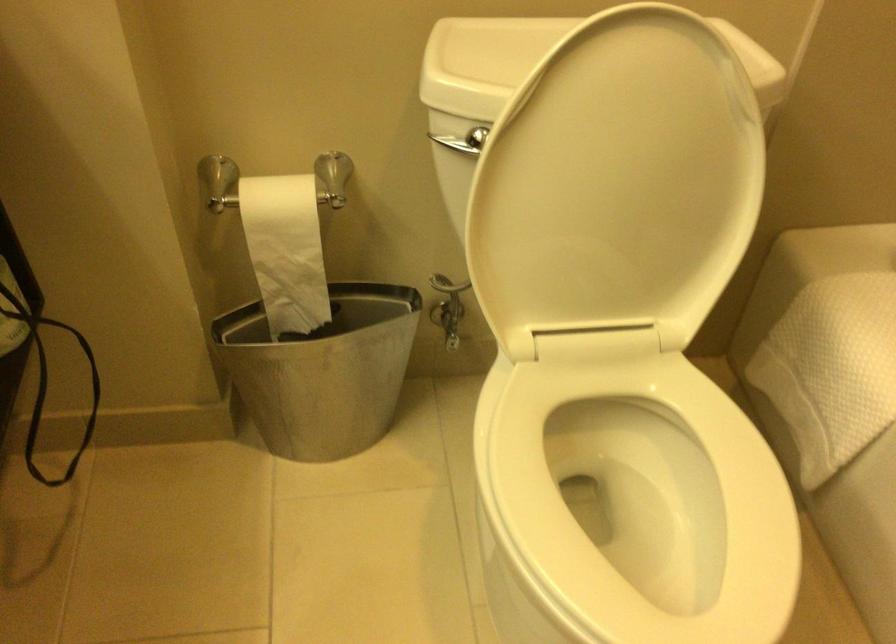
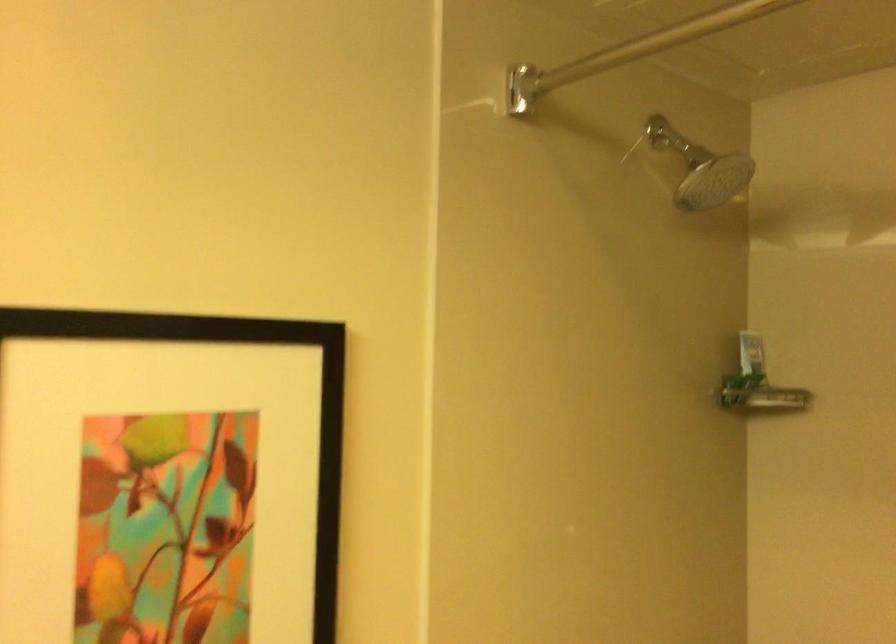
Based on the continuous images, in which direction is the camera rotating?

The camera's rotation is toward right-up.